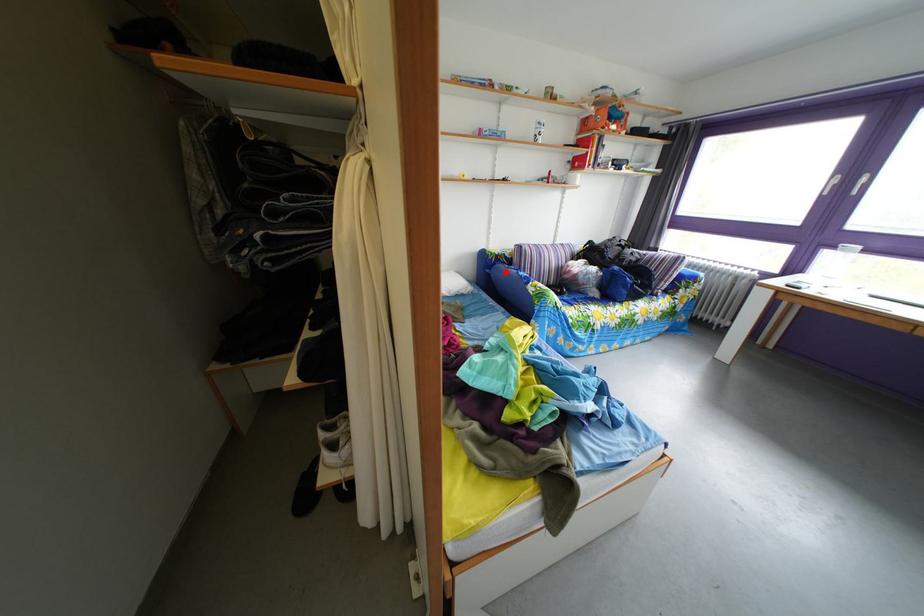
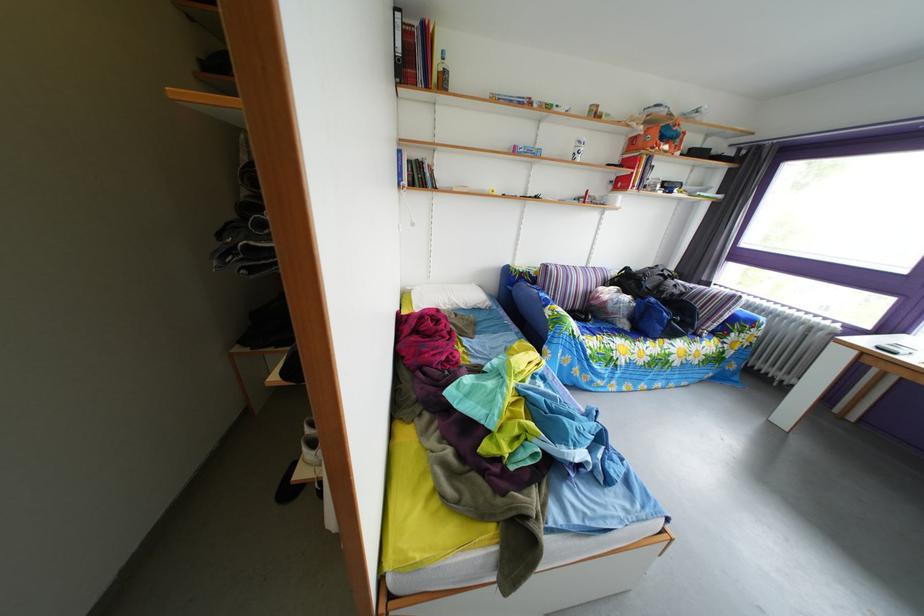
In the second image, find the point that corresponds to the highlighted location in the first image.

(529, 289)